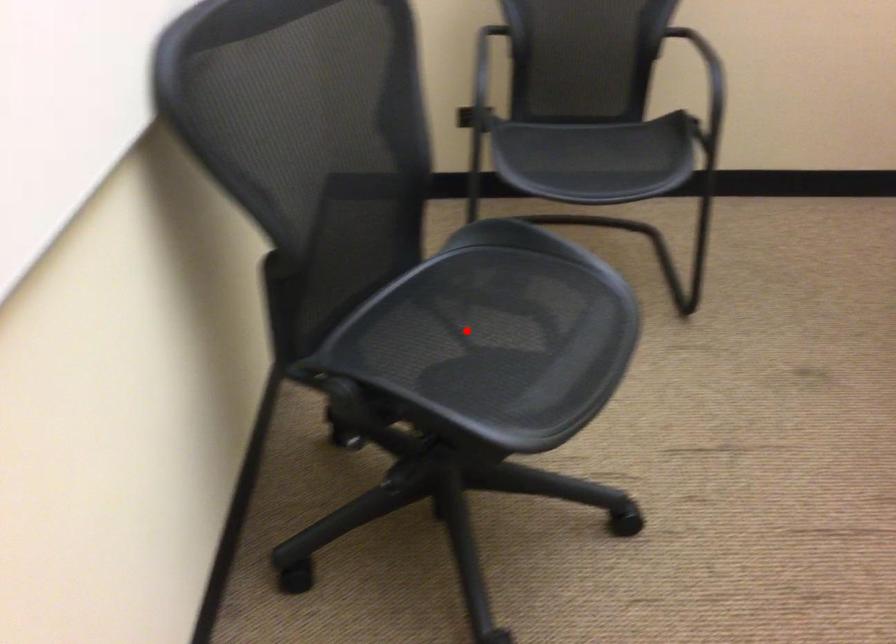
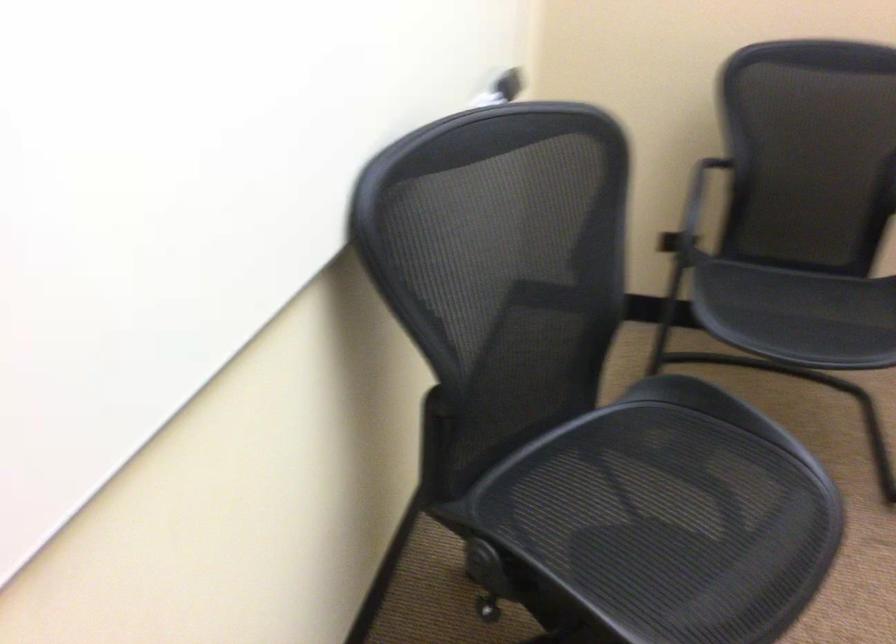
Locate, in the second image, the point that corresponds to the highlighted location in the first image.

(634, 502)